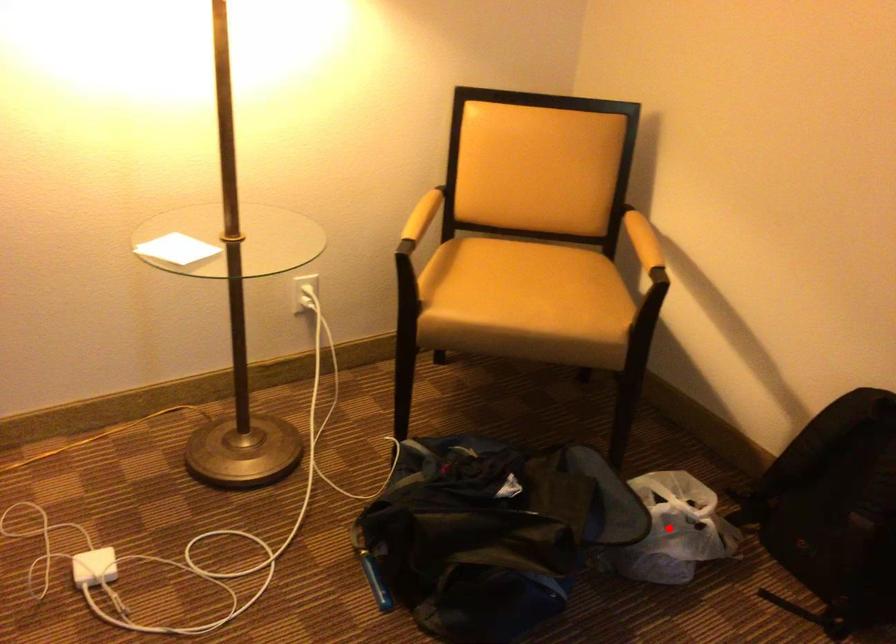
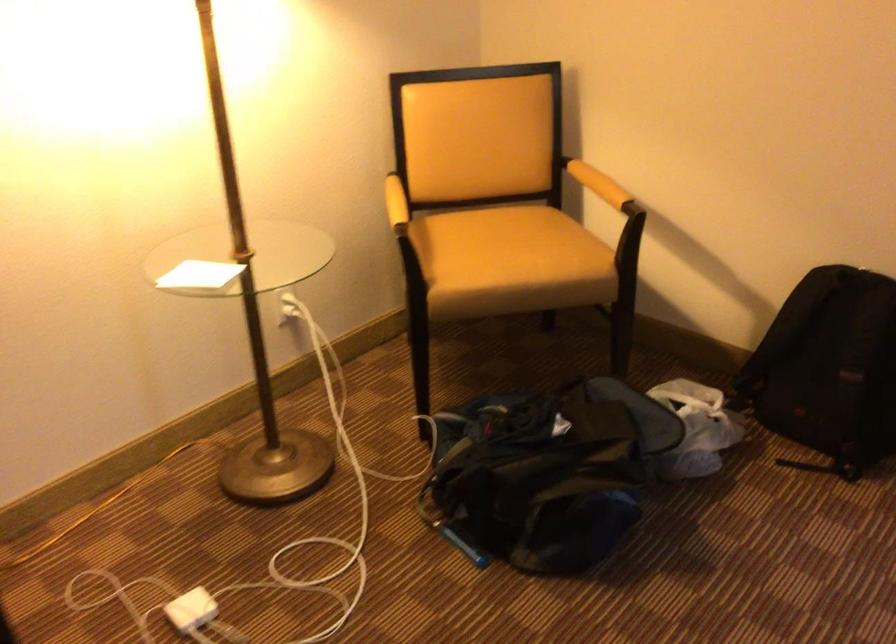
Question: I am providing you with two images of the same scene from different viewpoints. In image1, a red point is highlighted. Considering the same 3D point in image2, which of the following is correct?

Choices:
 (A) It is closer
 (B) It is farther

Answer: (B)